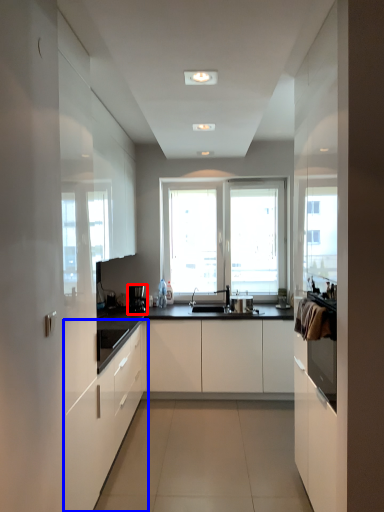
Question: Which point is closer to the camera, coffee machine (highlighted by a red box) or cabinetry (highlighted by a blue box)?

Choices:
 (A) coffee machine
 (B) cabinetry

Answer: (B)